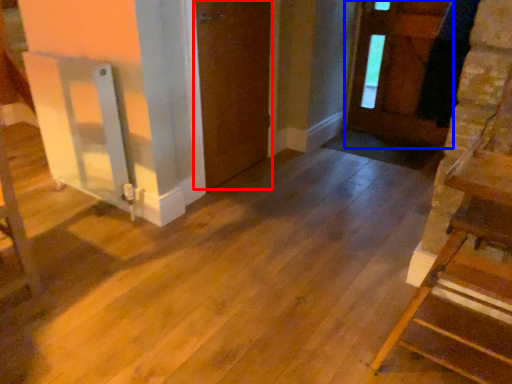
Question: Which object appears closest to the camera in this image, door (highlighted by a red box) or door (highlighted by a blue box)?

Choices:
 (A) door
 (B) door

Answer: (A)